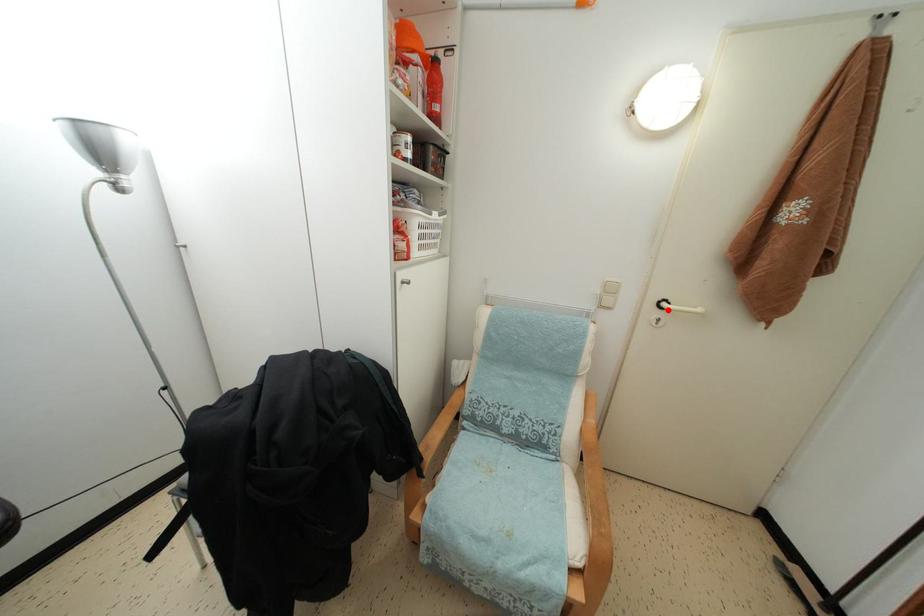
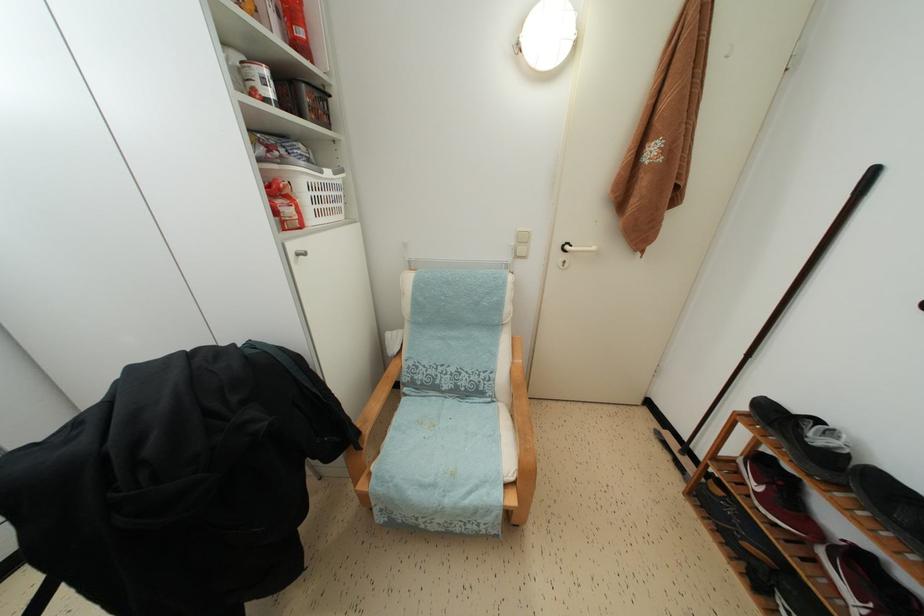
Find the pixel in the second image that matches the highlighted location in the first image.

(572, 253)